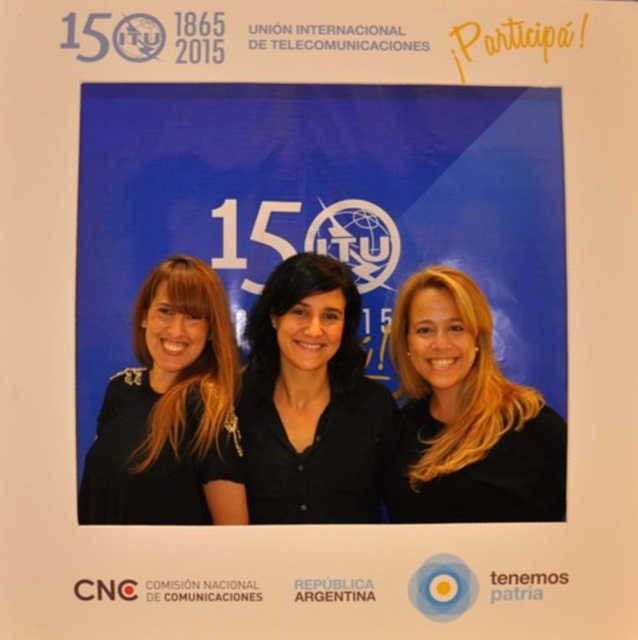
Question: Which point is farther from the camera taking this photo?

Choices:
 (A) (315, 305)
 (B) (82, 520)

Answer: (A)

Question: Does black matte shirt at center have a greater width compared to blonde hair at center?

Choices:
 (A) yes
 (B) no

Answer: (B)

Question: Is black matte shirt at center below blonde hair at center?

Choices:
 (A) no
 (B) yes

Answer: (A)

Question: Estimate the real-world distances between objects in this image. Which object is farther from the black matte shirt at center?

Choices:
 (A) blonde hair at center
 (B) blonde hair at left

Answer: (A)

Question: Which point is closer to the camera?

Choices:
 (A) (152, 486)
 (B) (478, 474)
 (C) (248, 465)

Answer: (A)

Question: Is black matte shirt at center positioned in front of blonde hair at left?

Choices:
 (A) no
 (B) yes

Answer: (A)